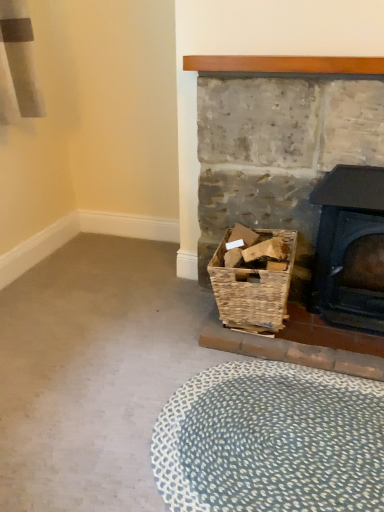
This screenshot has width=384, height=512. I want to click on free space above rustic wicker basket at lower right (from a real-world perspective), so click(x=295, y=75).